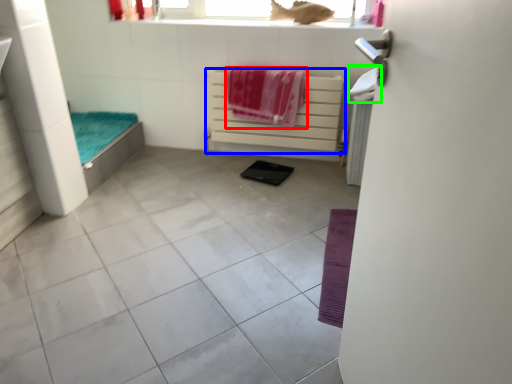
Question: Estimate the real-world distances between objects in this image. Which object is farther from beach towel (highlighted by a red box), balustrade (highlighted by a blue box) or beach towel (highlighted by a green box)?

Choices:
 (A) balustrade
 (B) beach towel

Answer: (B)